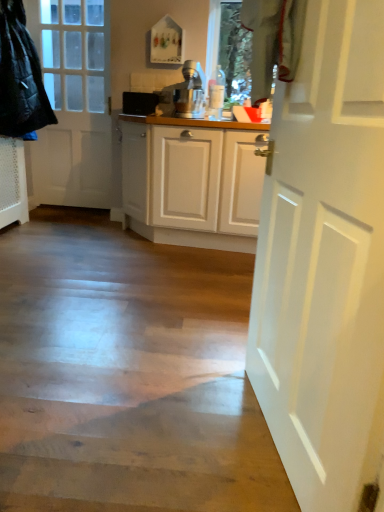
Question: In terms of size, does white matte door at left, which is counted as the second door, starting from the front, appear bigger or smaller than black plastic speaker at center?

Choices:
 (A) big
 (B) small

Answer: (A)

Question: Looking at their shapes, would you say white matte door at left, the first door in the top-to-bottom sequence, is wider or thinner than black plastic speaker at center?

Choices:
 (A) wide
 (B) thin

Answer: (A)

Question: Based on their relative distances, which object is farther from the black plastic speaker at center?

Choices:
 (A) quilted black jacket at left
 (B) white matte door at right, the 2th door positioned from the top
 (C) white matte door at left, the first door in the top-to-bottom sequence

Answer: (B)

Question: Which object is the closest to the quilted black jacket at left?

Choices:
 (A) white matte door at left, the second door ordered from the bottom
 (B) black plastic speaker at center
 (C) white matte door at right, which appears as the 1th door when viewed from the right

Answer: (A)